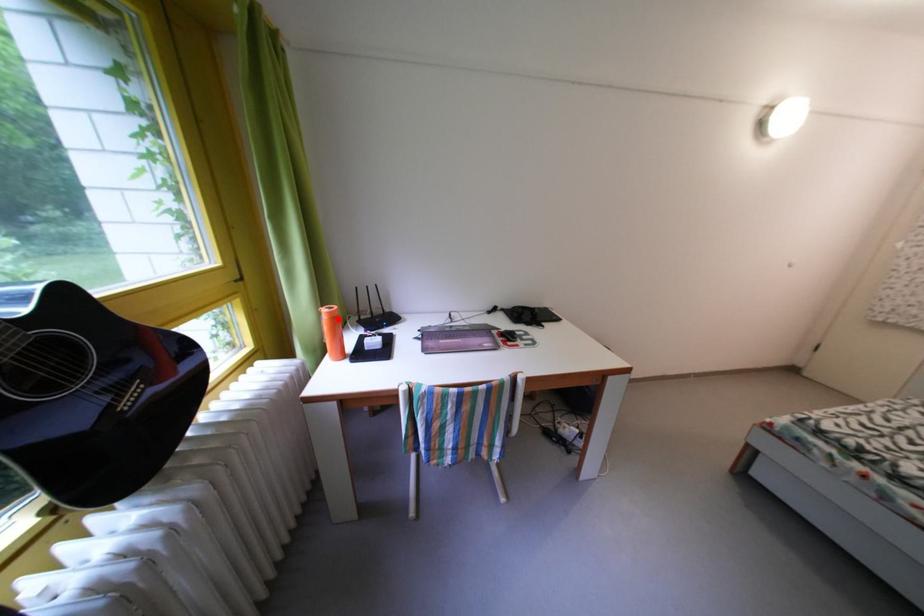
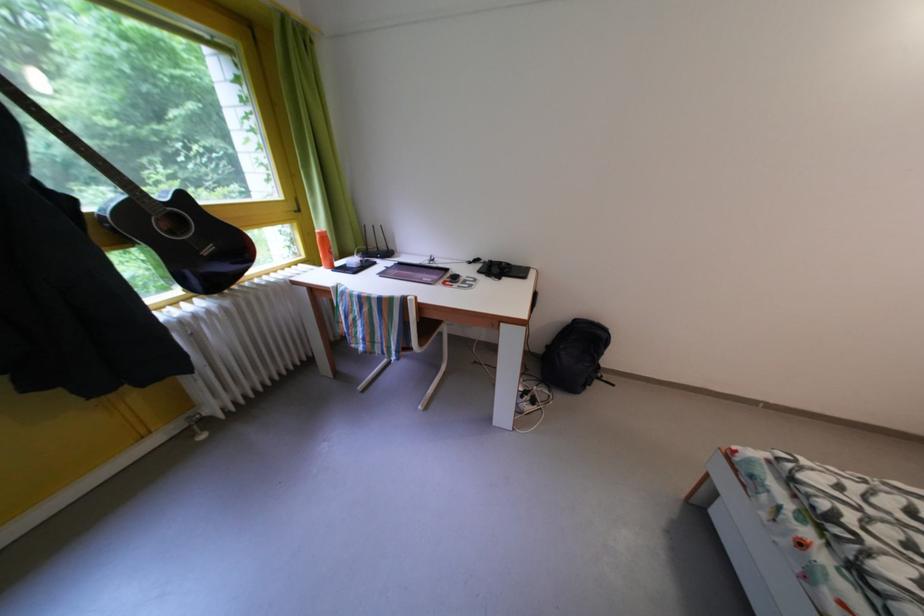
Where in the second image is the point corresponding to the highlighted location from the first image?

(329, 238)